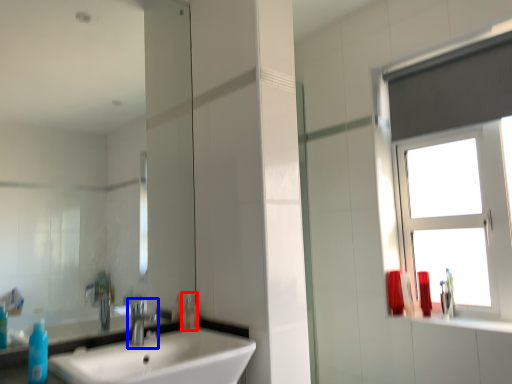
Question: Which object is further to the camera taking this photo, toiletry (highlighted by a red box) or tap (highlighted by a blue box)?

Choices:
 (A) toiletry
 (B) tap

Answer: (A)